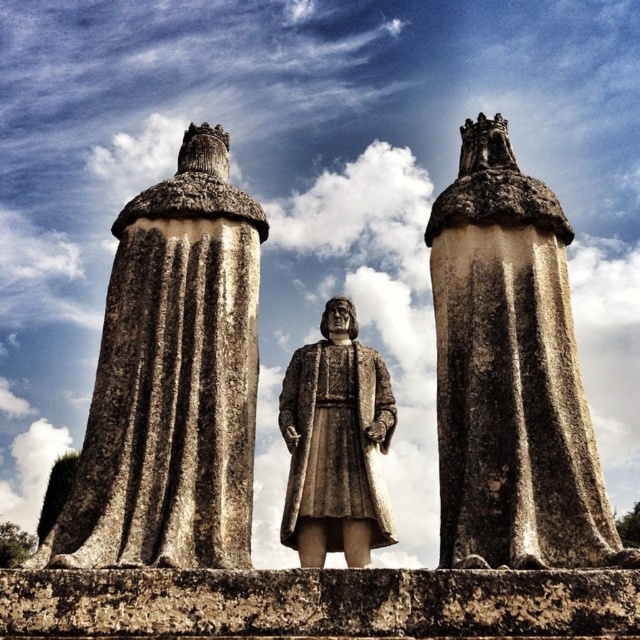
Question: Among these objects, which one is farthest from the camera?

Choices:
 (A) fur-like brown robe at center
 (B) stone statue at left

Answer: (A)

Question: Which object is closer to the camera taking this photo?

Choices:
 (A) stone statue at left
 (B) fur-like brown robe at center
 (C) stone column at center

Answer: (C)

Question: Among these points, which one is nearest to the camera?

Choices:
 (A) (192, 276)
 (B) (564, 496)

Answer: (B)

Question: Can you confirm if stone column at center is bigger than fur-like brown robe at center?

Choices:
 (A) no
 (B) yes

Answer: (B)

Question: Is stone column at center smaller than fur-like brown robe at center?

Choices:
 (A) yes
 (B) no

Answer: (B)

Question: Can you confirm if stone column at center is bigger than fur-like brown robe at center?

Choices:
 (A) yes
 (B) no

Answer: (A)